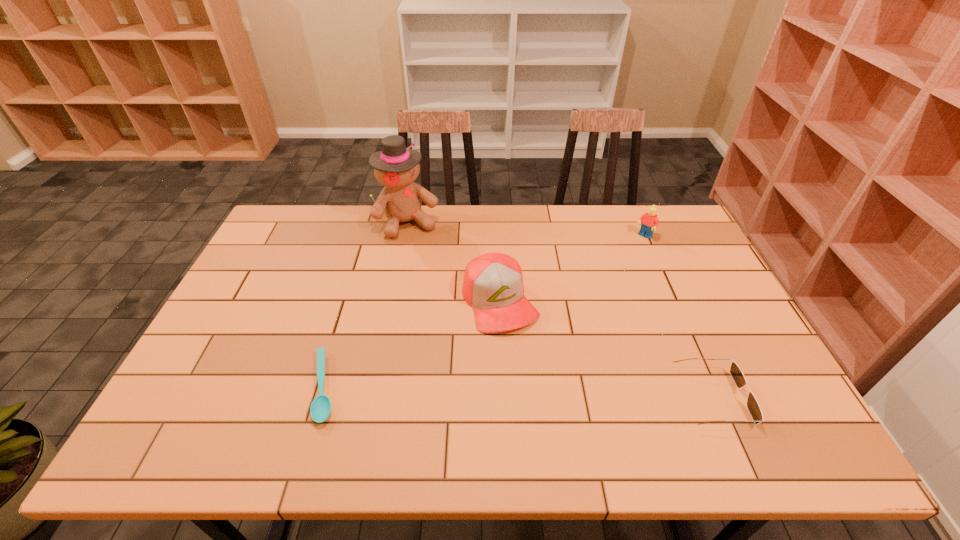
Locate an element on the screen. This screenshot has height=540, width=960. object that is the third closest one to the tallest object is located at coordinates (649, 220).

Identify the location of vacant space that satisfies the following two spatial constraints: 1. on the front side of the baseball cap; 2. on the front-facing side of the sunglasses. (504, 398).